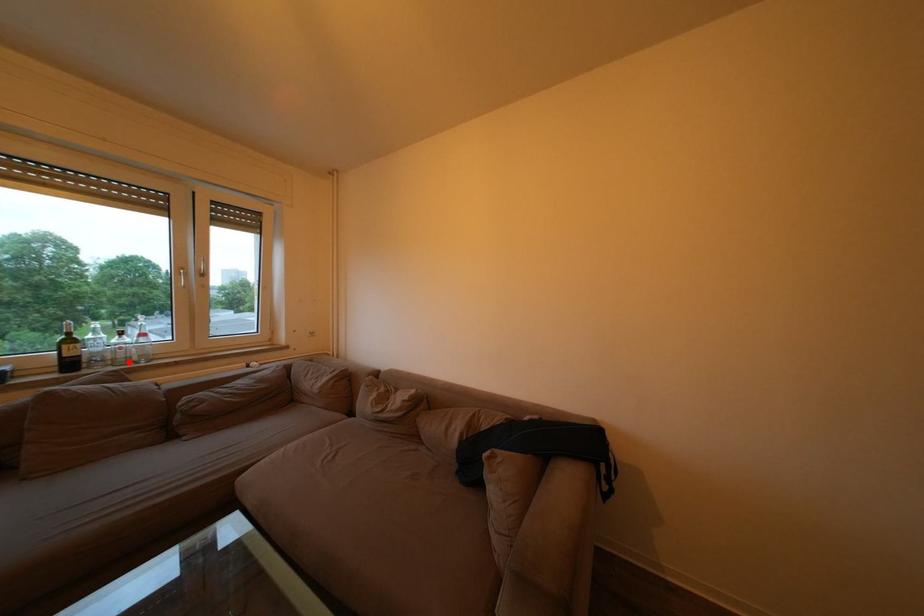
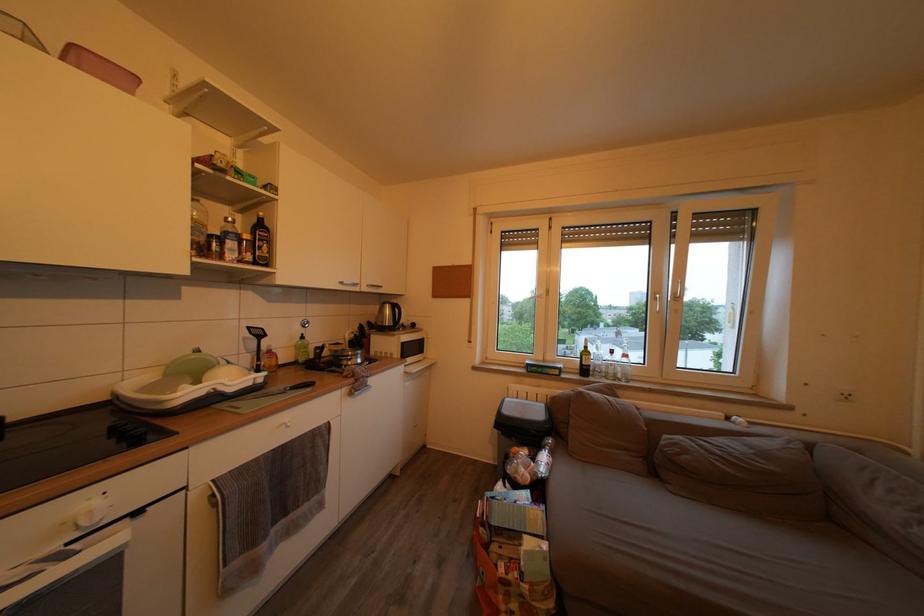
Question: I am providing you with two images of the same scene from different viewpoints. A red point is shown in image1. For the corresponding object point in image2, is it positioned nearer or farther from the camera?

Choices:
 (A) Nearer
 (B) Farther

Answer: (B)